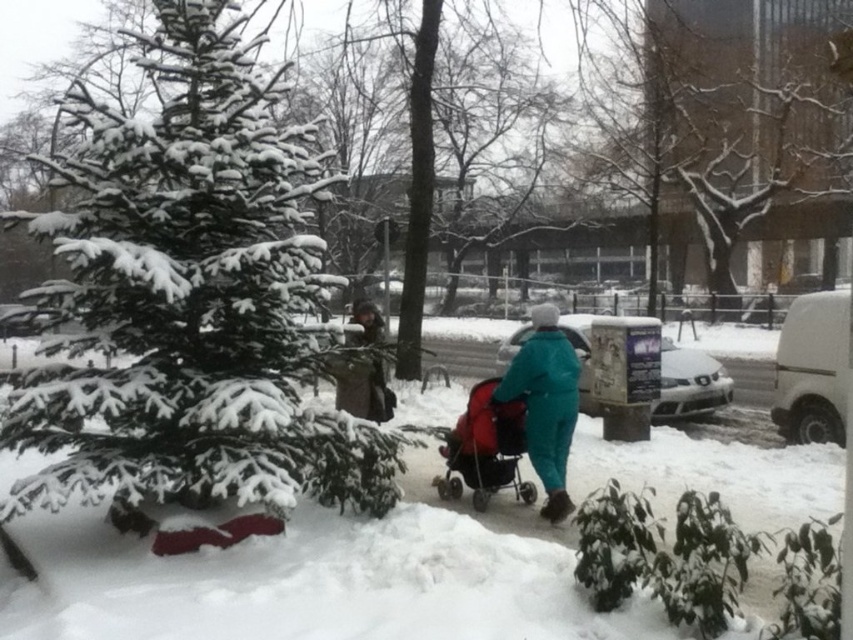
From the picture: You are standing at the center of the image and want to walk towards the teal fabric stroller at center. Which direction should you move?

The teal fabric stroller at center is already at the center of the image, so you don not need to move in any direction to reach it.